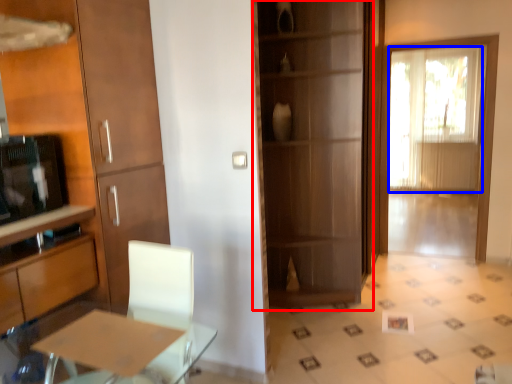
Question: Which object is further to the camera taking this photo, cupboard (highlighted by a red box) or window screen (highlighted by a blue box)?

Choices:
 (A) cupboard
 (B) window screen

Answer: (B)